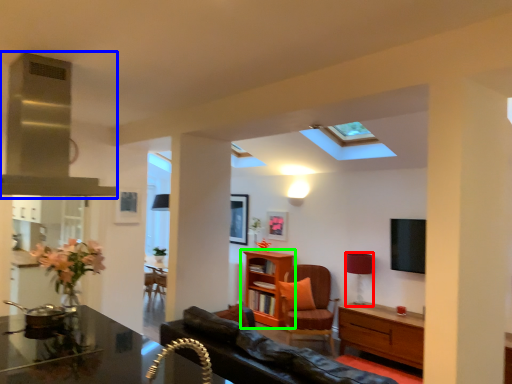
Question: Which is nearer to the lamp (highlighted by a red box)? exhaust hood (highlighted by a blue box) or shelf (highlighted by a green box).

Choices:
 (A) exhaust hood
 (B) shelf

Answer: (B)